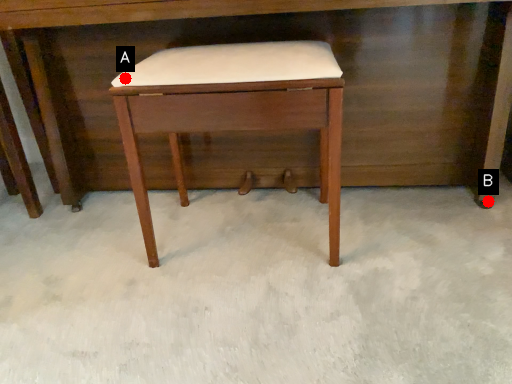
Question: Two points are circled on the image, labeled by A and B beside each circle. Which point is farther from the camera taking this photo?

Choices:
 (A) A is further
 (B) B is further

Answer: (B)